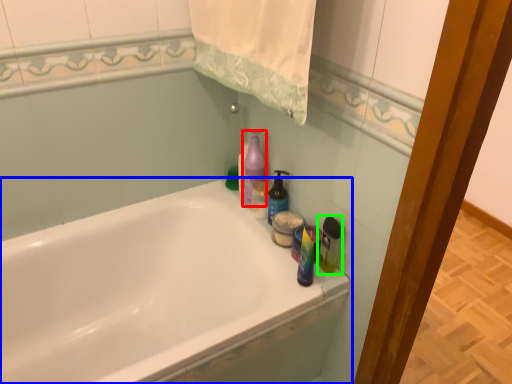
Question: Considering the real-world distances, which object is closest to cleaning product (highlighted by a red box)? bathtub (highlighted by a blue box) or cleaning product (highlighted by a green box).

Choices:
 (A) bathtub
 (B) cleaning product

Answer: (B)